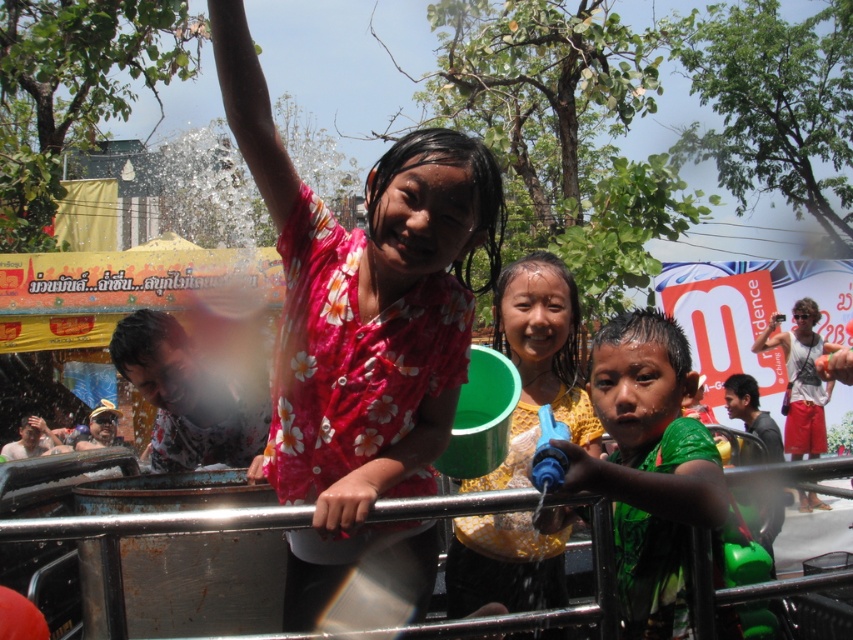
Consider the image. Who is more forward, [663,337] or [531,385]?

Point [663,337] is in front.

Is wet green shirt at center wider than yellow floral shirt at center?

Incorrect, wet green shirt at center's width does not surpass yellow floral shirt at center's.

This screenshot has width=853, height=640. Describe the element at coordinates (648, 465) in the screenshot. I see `wet green shirt at center` at that location.

You are a GUI agent. You are given a task and a screenshot of the screen. Output one action in this format:
    pyautogui.click(x=<x>, y=<y>)
    Task: Click on the wet green shirt at center
    The width and height of the screenshot is (853, 640).
    Given the screenshot: What is the action you would take?
    pyautogui.click(x=648, y=465)

Between floral fabric shirt at center and yellow floral shirt at center, which one is positioned higher?

Positioned higher is floral fabric shirt at center.

You are a GUI agent. You are given a task and a screenshot of the screen. Output one action in this format:
    pyautogui.click(x=<x>, y=<y>)
    Task: Click on the floral fabric shirt at center
    
    Given the screenshot: What is the action you would take?
    pyautogui.click(x=358, y=323)

This screenshot has width=853, height=640. What do you see at coordinates (358, 323) in the screenshot?
I see `floral fabric shirt at center` at bounding box center [358, 323].

You are a GUI agent. You are given a task and a screenshot of the screen. Output one action in this format:
    pyautogui.click(x=<x>, y=<y>)
    Task: Click on the floral fabric shirt at center
    
    Given the screenshot: What is the action you would take?
    pyautogui.click(x=358, y=323)

Can you confirm if floral fabric shirt at center is taller than white tank top at center?

No, floral fabric shirt at center is not taller than white tank top at center.

Who is more distant from viewer, (347, 456) or (809, 316)?

The point (809, 316) is more distant.

At what (x,y) coordinates should I click in order to perform the action: click on floral fabric shirt at center. Please return your answer as a coordinate pair (x, y). This screenshot has height=640, width=853. Looking at the image, I should click on (358, 323).